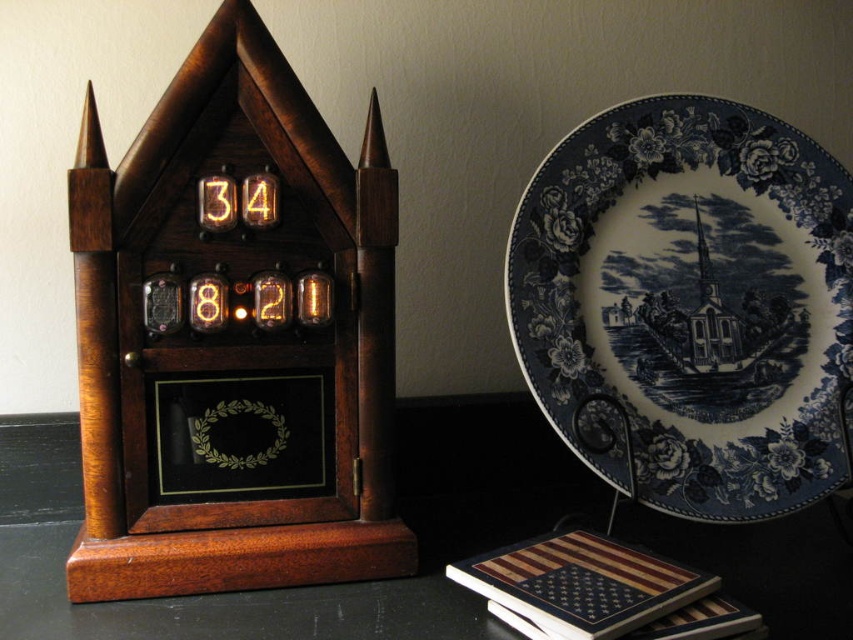
Between blue ceramic plate at upper right and wooden table at center, which one has less height?

With less height is wooden table at center.

From the picture: Does blue ceramic plate at upper right appear on the right side of wooden table at center?

Indeed, blue ceramic plate at upper right is positioned on the right side of wooden table at center.

Identify the location of blue ceramic plate at upper right. This screenshot has width=853, height=640. (689, 305).

Is point (224, 198) in front of point (485, 589)?

No, it is behind (485, 589).

Consider the image. Does polished wood clock at center appear on the left side of wooden american flag at lower right?

Indeed, polished wood clock at center is positioned on the left side of wooden american flag at lower right.

Is point (380, 148) in front of point (508, 561)?

No.

The image size is (853, 640). Identify the location of polished wood clock at center. (234, 337).

Measure the distance from polished wood clock at center to wooden table at center.

polished wood clock at center and wooden table at center are 7.99 inches apart.

Between polished wood clock at center and wooden table at center, which one is positioned higher?

polished wood clock at center is higher up.

Between point (196, 401) and point (18, 564), which one is positioned in front?

Positioned in front is point (196, 401).

Identify the location of polished wood clock at center. (234, 337).